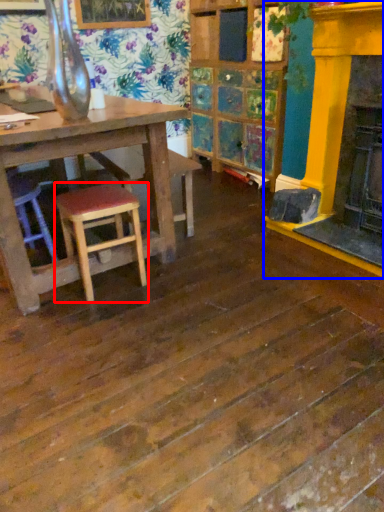
Question: Which object appears closest to the camera in this image, stool (highlighted by a red box) or fireplace (highlighted by a blue box)?

Choices:
 (A) stool
 (B) fireplace

Answer: (A)